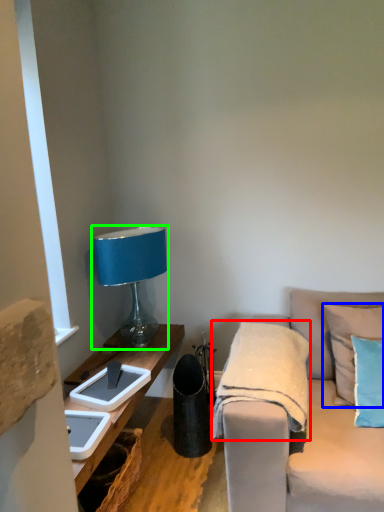
Question: Which is nearer to the blanket (highlighted by a red box)? pillow (highlighted by a blue box) or lamp (highlighted by a green box).

Choices:
 (A) pillow
 (B) lamp

Answer: (A)